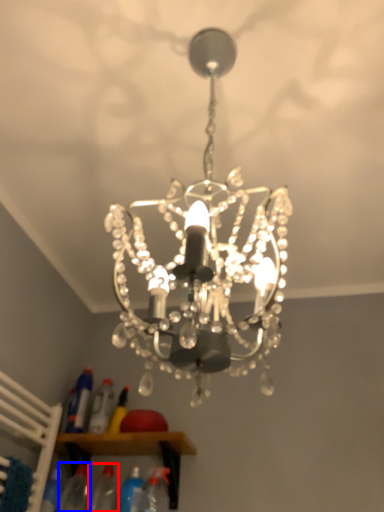
Question: Which object appears farthest to the camera in this image, bottle (highlighted by a red box) or bottle (highlighted by a blue box)?

Choices:
 (A) bottle
 (B) bottle

Answer: (B)